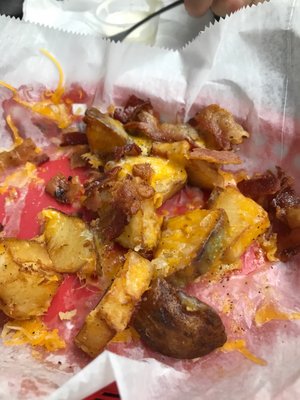
I want to click on cup, so click(x=112, y=28).